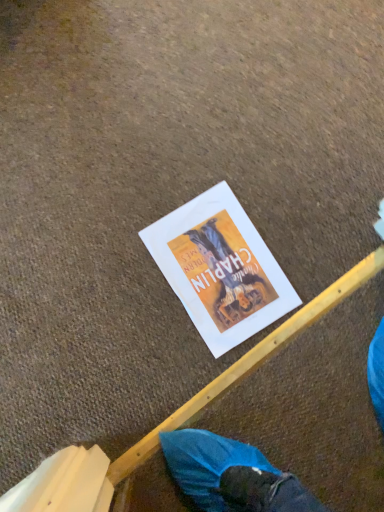
The width and height of the screenshot is (384, 512). I want to click on free space to the left of matte paper flyer at center, so click(x=119, y=210).